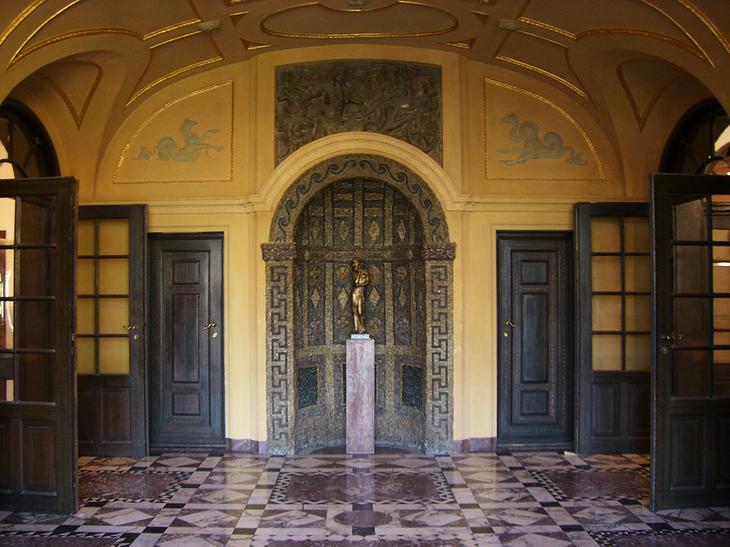
In order to click on floor in this screenshot , I will do `click(395, 519)`.